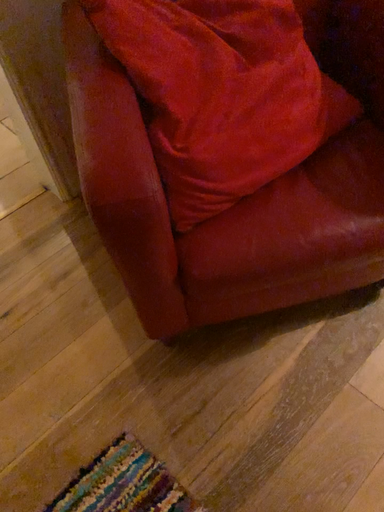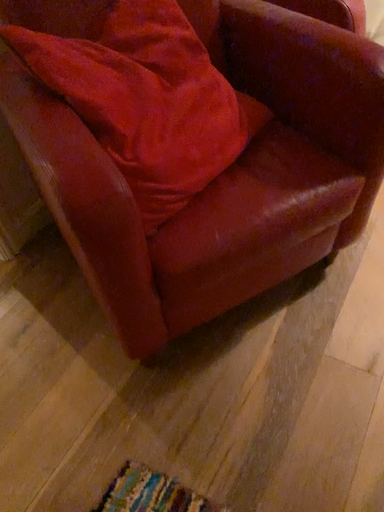
Question: Which way did the camera rotate in the video?

Choices:
 (A) rotated left
 (B) rotated right

Answer: (B)